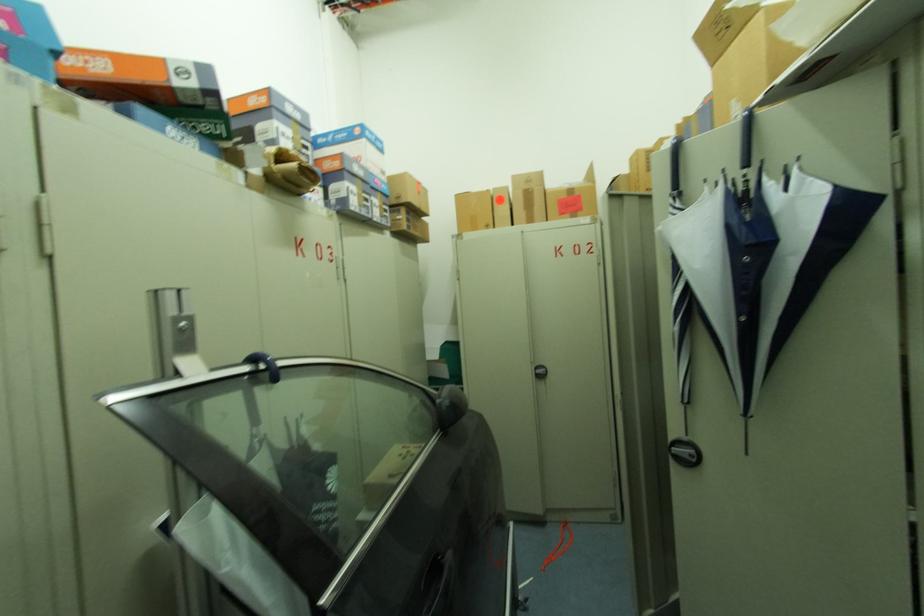
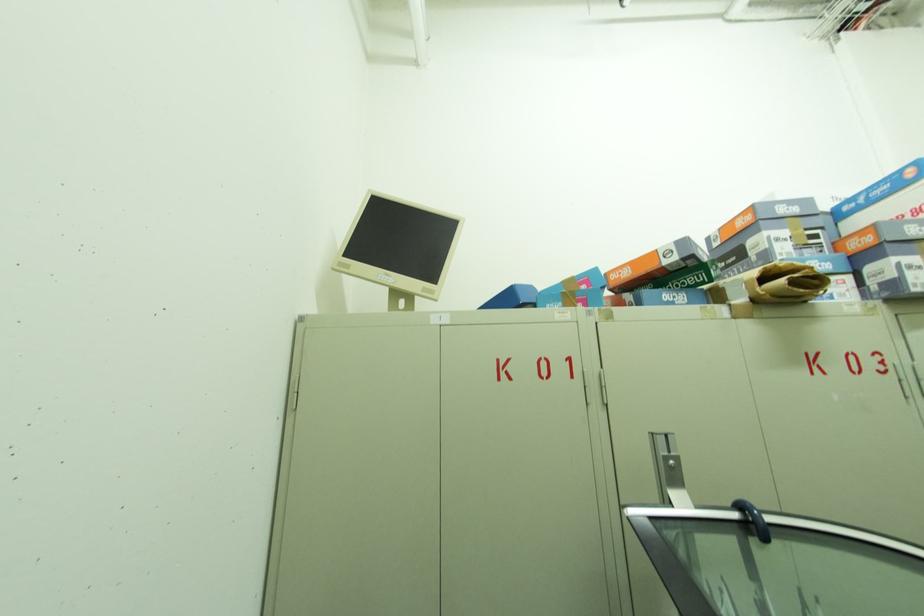
Question: The camera is either moving clockwise (left) or counter-clockwise (right) around the object. The first image is from the beginning of the video and the second image is from the end. Is the camera moving left or right when shooting the video?

Choices:
 (A) Left
 (B) Right

Answer: (B)